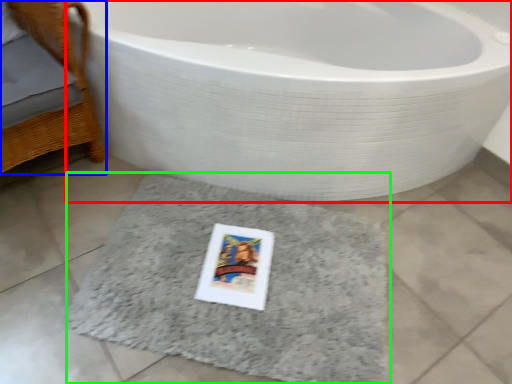
Question: Which is farther away from bathtub (highlighted by a red box)? furniture (highlighted by a blue box) or bath mat (highlighted by a green box)?

Choices:
 (A) furniture
 (B) bath mat

Answer: (A)